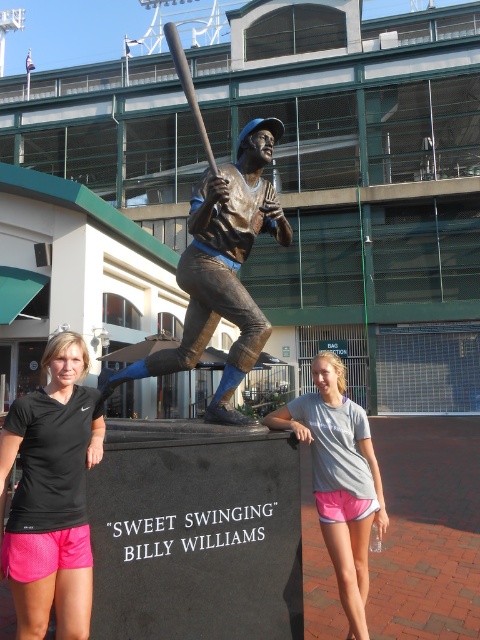
Question: Which object is positioned closest to the black athletic wear at center?

Choices:
 (A) black nike dri-fit shirt at center
 (B) bronze statue at center
 (C) bronze metallic bat at center
 (D) gray cotton t-shirt at center

Answer: (A)

Question: Can you confirm if black nike dri-fit shirt at center is bigger than gray cotton t-shirt at center?

Choices:
 (A) no
 (B) yes

Answer: (A)

Question: In this image, where is black nike dri-fit shirt at center located relative to gray cotton t-shirt at center?

Choices:
 (A) right
 (B) left

Answer: (B)

Question: Is black nike dri-fit shirt at center to the left of bronze metallic bat at center from the viewer's perspective?

Choices:
 (A) yes
 (B) no

Answer: (A)

Question: Which object is farther from the camera taking this photo?

Choices:
 (A) black athletic wear at center
 (B) black nike dri-fit shirt at center

Answer: (A)

Question: Which point is closer to the camera taking this photo?

Choices:
 (A) pos(190,84)
 (B) pos(23,483)
 (C) pos(351,596)
 (D) pos(133,378)

Answer: (B)